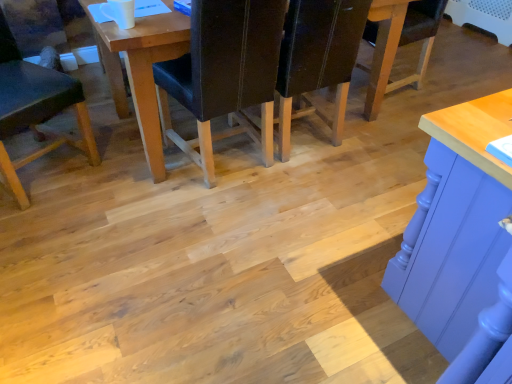
What do you see at coordinates (141, 70) in the screenshot? Image resolution: width=512 pixels, height=384 pixels. I see `wooden table at center` at bounding box center [141, 70].

This screenshot has width=512, height=384. I want to click on matte black chair at lower left, the third chair in the right-to-left sequence, so click(36, 110).

What do you see at coordinates (36, 110) in the screenshot?
I see `matte black chair at lower left, the third chair in the right-to-left sequence` at bounding box center [36, 110].

Where is `wooden table at center`? This screenshot has height=384, width=512. wooden table at center is located at coordinates (141, 70).

Which is more to the right, black leather chair at center, marked as the 2th chair in a right-to-left arrangement, or dark brown leather chair at center, which is the first chair from right to left?

dark brown leather chair at center, which is the first chair from right to left, is more to the right.

From the image's perspective, which is above, black leather chair at center, marked as the 2th chair in a right-to-left arrangement, or dark brown leather chair at center, which appears as the third chair when viewed from the left?

From the image's view, dark brown leather chair at center, which appears as the third chair when viewed from the left, is above.

From a real-world perspective, count 2nd chairs downward from the black leather chair at center, arranged as the second chair when viewed from the left, and point to it. Please provide its 2D coordinates.

[(317, 60)]

Choose the correct answer: Is black leather chair at center, marked as the 2th chair in a right-to-left arrangement, inside dark brown leather chair at center, which appears as the third chair when viewed from the left, or outside it?

black leather chair at center, marked as the 2th chair in a right-to-left arrangement, exists outside the volume of dark brown leather chair at center, which appears as the third chair when viewed from the left.

Is there a large distance between wooden table at center and dark brown leather chair at center, which appears as the third chair when viewed from the left?

No, wooden table at center is not far away from dark brown leather chair at center, which appears as the third chair when viewed from the left.

From a real-world perspective, is wooden table at center located higher than dark brown leather chair at center, which appears as the third chair when viewed from the left?

No, from a real-world perspective, wooden table at center is not on top of dark brown leather chair at center, which appears as the third chair when viewed from the left.

Does wooden table at center turn towards dark brown leather chair at center, which appears as the third chair when viewed from the left?

Yes, wooden table at center is aimed at dark brown leather chair at center, which appears as the third chair when viewed from the left.

Is dark brown leather chair at center, which appears as the third chair when viewed from the left, surrounded by wooden table at center?

Yes, dark brown leather chair at center, which appears as the third chair when viewed from the left, is a part of wooden table at center.

Which object is further away from the camera taking this photo, dark brown leather chair at center, which appears as the third chair when viewed from the left, or wooden table at center?

dark brown leather chair at center, which appears as the third chair when viewed from the left, is behind.

Can you confirm if dark brown leather chair at center, which is the first chair from right to left, is wider than wooden table at center?

Incorrect, the width of dark brown leather chair at center, which is the first chair from right to left, does not surpass that of wooden table at center.

Is point (345, 9) in front of point (113, 27)?

That is False.

Can you see dark brown leather chair at center, which is the first chair from right to left, touching wooden table at center?

dark brown leather chair at center, which is the first chair from right to left, and wooden table at center are not in contact.

Is black leather chair at center, marked as the 2th chair in a right-to-left arrangement, positioned behind matte black chair at lower left, the third chair in the right-to-left sequence?

Yes, black leather chair at center, marked as the 2th chair in a right-to-left arrangement, is further from the viewer.

From the image's perspective, is black leather chair at center, arranged as the second chair when viewed from the left, beneath matte black chair at lower left, the first chair viewed from the left?

No, from the image's perspective, black leather chair at center, arranged as the second chair when viewed from the left, is not beneath matte black chair at lower left, the first chair viewed from the left.

Looking at this image, which object is thinner, black leather chair at center, arranged as the second chair when viewed from the left, or matte black chair at lower left, the first chair viewed from the left?

With smaller width is matte black chair at lower left, the first chair viewed from the left.

Consider the image. Would you say black leather chair at center, marked as the 2th chair in a right-to-left arrangement, is to the left or to the right of matte black chair at lower left, the first chair viewed from the left, in the picture?

black leather chair at center, marked as the 2th chair in a right-to-left arrangement, is positioned on matte black chair at lower left, the first chair viewed from the left,'s right side.

Looking at their sizes, would you say wooden table at center is wider or thinner than black leather chair at center, arranged as the second chair when viewed from the left?

wooden table at center is wider than black leather chair at center, arranged as the second chair when viewed from the left.

Between wooden table at center and black leather chair at center, arranged as the second chair when viewed from the left, which one is positioned behind?

wooden table at center is behind.

Considering the positions of points (111, 56) and (198, 156), is point (111, 56) farther from camera compared to point (198, 156)?

Yes, point (111, 56) is behind point (198, 156).

Can you confirm if wooden table at center is bigger than black leather chair at center, marked as the 2th chair in a right-to-left arrangement?

Yes.

Which of these two, matte black chair at lower left, the third chair in the right-to-left sequence, or wooden table at center, stands taller?

matte black chair at lower left, the third chair in the right-to-left sequence, is taller.

From the picture: Is matte black chair at lower left, the first chair viewed from the left, outside of wooden table at center?

Yes, matte black chair at lower left, the first chair viewed from the left, is outside of wooden table at center.

Which object is closer to the camera, matte black chair at lower left, the third chair in the right-to-left sequence, or wooden table at center?

matte black chair at lower left, the third chair in the right-to-left sequence.

Can you tell me how much dark brown leather chair at center, which is the first chair from right to left, and black leather chair at center, arranged as the second chair when viewed from the left, differ in facing direction?

5.14 degrees separate the facing orientations of dark brown leather chair at center, which is the first chair from right to left, and black leather chair at center, arranged as the second chair when viewed from the left.

Which is in front, dark brown leather chair at center, which appears as the third chair when viewed from the left, or black leather chair at center, marked as the 2th chair in a right-to-left arrangement?

Positioned in front is black leather chair at center, marked as the 2th chair in a right-to-left arrangement.

From the image's perspective, is dark brown leather chair at center, which is the first chair from right to left, positioned above or below black leather chair at center, marked as the 2th chair in a right-to-left arrangement?

Based on their image positions, dark brown leather chair at center, which is the first chair from right to left, is located above black leather chair at center, marked as the 2th chair in a right-to-left arrangement.

Is dark brown leather chair at center, which appears as the third chair when viewed from the left, turned away from black leather chair at center, arranged as the second chair when viewed from the left?

dark brown leather chair at center, which appears as the third chair when viewed from the left, is not turned away from black leather chair at center, arranged as the second chair when viewed from the left.

Where is `chair located above the black leather chair at center, marked as the 2th chair in a right-to-left arrangement (from the image's perspective)`? chair located above the black leather chair at center, marked as the 2th chair in a right-to-left arrangement (from the image's perspective) is located at coordinates (317, 60).

Where is `table in front of the dark brown leather chair at center, which is the first chair from right to left`? table in front of the dark brown leather chair at center, which is the first chair from right to left is located at coordinates (141, 70).

Looking at the image, which one is located further to matte black chair at lower left, the first chair viewed from the left, wooden table at center or dark brown leather chair at center, which is the first chair from right to left?

dark brown leather chair at center, which is the first chair from right to left, is positioned further to the anchor matte black chair at lower left, the first chair viewed from the left.

Looking at the image, which one is located closer to black leather chair at center, arranged as the second chair when viewed from the left, wooden table at center or matte black chair at lower left, the third chair in the right-to-left sequence?

wooden table at center is positioned closer to the anchor black leather chair at center, arranged as the second chair when viewed from the left.

Which object lies further to the anchor point dark brown leather chair at center, which appears as the third chair when viewed from the left, wooden table at center or matte black chair at lower left, the third chair in the right-to-left sequence?

matte black chair at lower left, the third chair in the right-to-left sequence, is positioned further to the anchor dark brown leather chair at center, which appears as the third chair when viewed from the left.

When comparing their distances from wooden table at center, does dark brown leather chair at center, which appears as the third chair when viewed from the left, or black leather chair at center, marked as the 2th chair in a right-to-left arrangement, seem further?

Among the two, dark brown leather chair at center, which appears as the third chair when viewed from the left, is located further to wooden table at center.

Based on their spatial positions, is dark brown leather chair at center, which appears as the third chair when viewed from the left, or matte black chair at lower left, the third chair in the right-to-left sequence, further from wooden table at center?

dark brown leather chair at center, which appears as the third chair when viewed from the left.

Which object lies nearer to the anchor point matte black chair at lower left, the third chair in the right-to-left sequence, dark brown leather chair at center, which is the first chair from right to left, or wooden table at center?

Among the two, wooden table at center is located nearer to matte black chair at lower left, the third chair in the right-to-left sequence.

From the image, which object appears to be farther from matte black chair at lower left, the first chair viewed from the left, black leather chair at center, arranged as the second chair when viewed from the left, or wooden table at center?

black leather chair at center, arranged as the second chair when viewed from the left.

Estimate the real-world distances between objects in this image. Which object is closer to black leather chair at center, marked as the 2th chair in a right-to-left arrangement, matte black chair at lower left, the third chair in the right-to-left sequence, or dark brown leather chair at center, which is the first chair from right to left?

Among the two, dark brown leather chair at center, which is the first chair from right to left, is located nearer to black leather chair at center, marked as the 2th chair in a right-to-left arrangement.

Locate an element on the screen. The image size is (512, 384). table between matte black chair at lower left, the first chair viewed from the left, and dark brown leather chair at center, which is the first chair from right to left, from left to right is located at coordinates (141, 70).

Identify the location of table situated between black leather chair at center, arranged as the second chair when viewed from the left, and dark brown leather chair at center, which appears as the third chair when viewed from the left, from left to right. This screenshot has width=512, height=384. (141, 70).

Locate an element on the screen. chair situated between matte black chair at lower left, the first chair viewed from the left, and dark brown leather chair at center, which is the first chair from right to left, from left to right is located at coordinates (224, 74).

Locate an element on the screen. The height and width of the screenshot is (384, 512). chair between matte black chair at lower left, the first chair viewed from the left, and wooden table at center, in the horizontal direction is located at coordinates (224, 74).